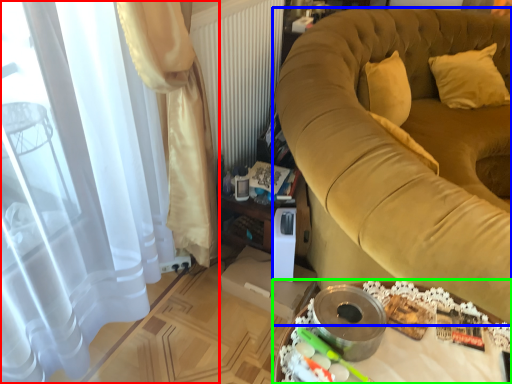
Question: Estimate the real-world distances between objects in this image. Which object is closer to curtain (highlighted by a red box), furniture (highlighted by a blue box) or table (highlighted by a green box)?

Choices:
 (A) furniture
 (B) table

Answer: (B)